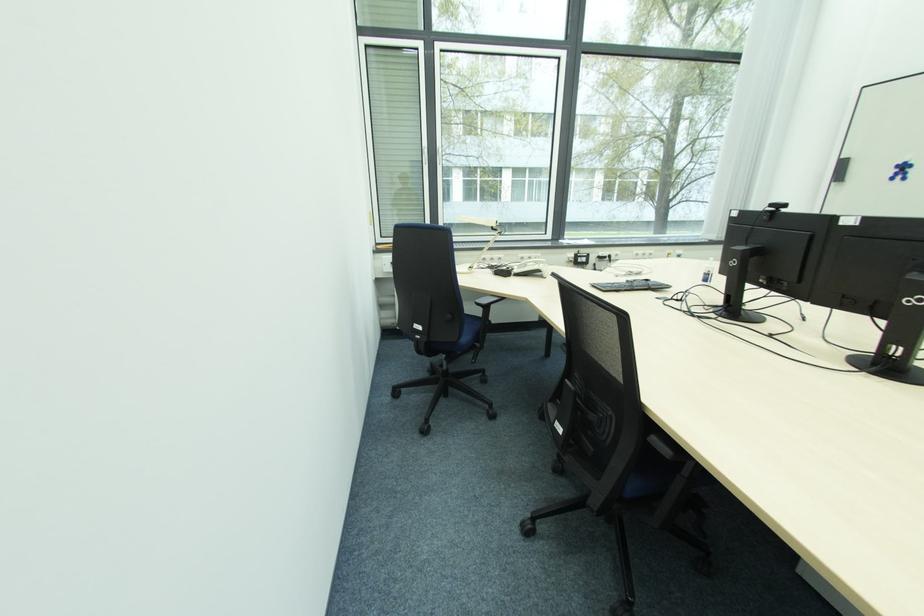
Identify the location of black chair armrest. (479, 302).